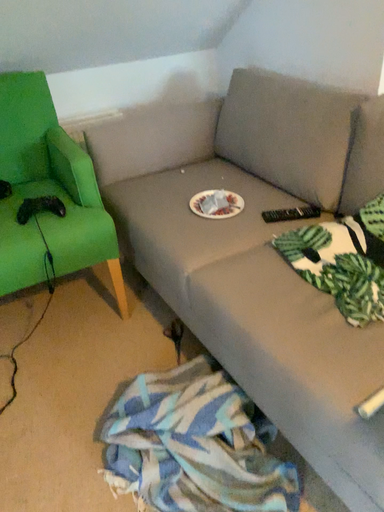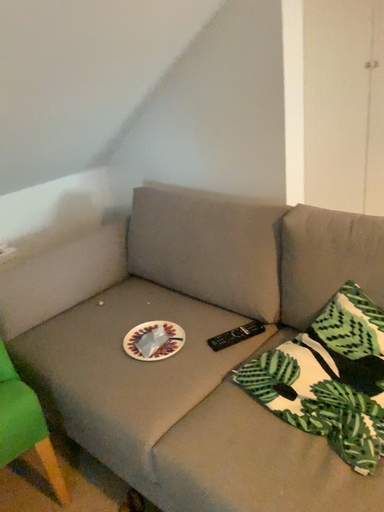
Question: How did the camera likely rotate when shooting the video?

Choices:
 (A) rotated upward
 (B) rotated downward

Answer: (A)